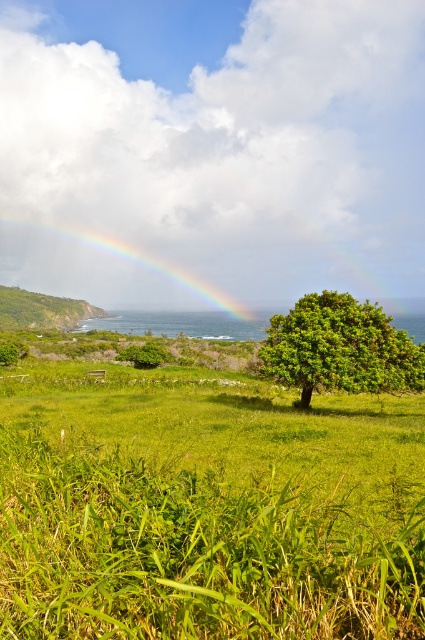
Question: Which of these objects is positioned farthest from the green leafy tree at center?

Choices:
 (A) green grassy hillside at left
 (B) rainbow at center

Answer: (B)

Question: Does green leafy tree at center have a smaller size compared to rainbow at center?

Choices:
 (A) yes
 (B) no

Answer: (A)

Question: Which object appears closest to the camera in this image?

Choices:
 (A) rainbow at center
 (B) green leafy tree at center

Answer: (B)

Question: Is green leafy tree at center to the right of green grassy hillside at left from the viewer's perspective?

Choices:
 (A) no
 (B) yes

Answer: (B)

Question: Which of the following is the farthest from the observer?

Choices:
 (A) (95, 268)
 (B) (6, 291)

Answer: (A)

Question: Is green leafy tree at center below green grassy hillside at left?

Choices:
 (A) no
 (B) yes

Answer: (B)